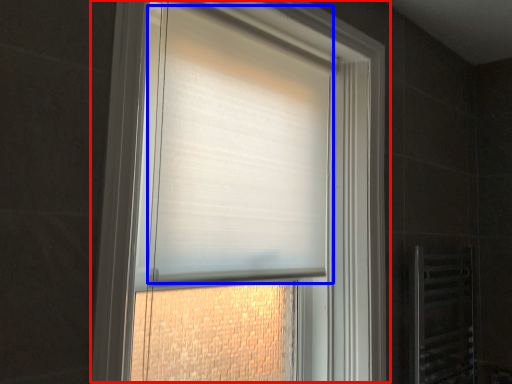
Question: Which object is further to the camera taking this photo, window (highlighted by a red box) or blind (highlighted by a blue box)?

Choices:
 (A) window
 (B) blind

Answer: (B)